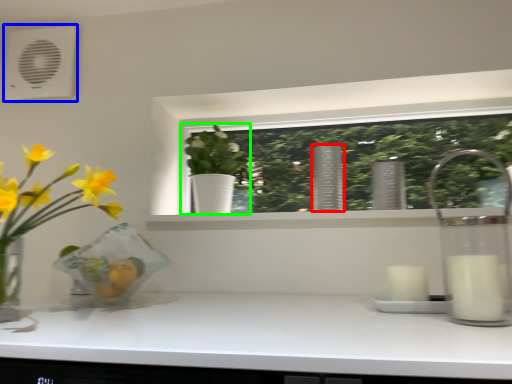
Question: Estimate the real-world distances between objects in this image. Which object is farther from vase (highlighted by a red box), air conditioning (highlighted by a blue box) or houseplant (highlighted by a green box)?

Choices:
 (A) air conditioning
 (B) houseplant

Answer: (A)